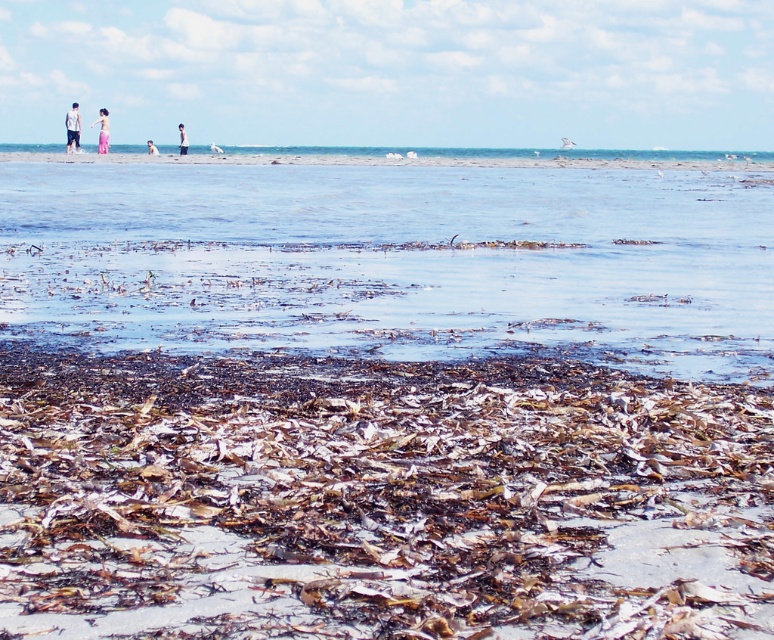
You are a photographer standing at the center of the beach scene. You want to take a photo of the pink fabric dress at upper left. Where should you position yourself to capture it in the frame?

To capture the pink fabric dress at upper left in the frame, position yourself at the center of the beach scene and aim your camera towards the upper left direction, specifically targeting the coordinates point at [101,131].